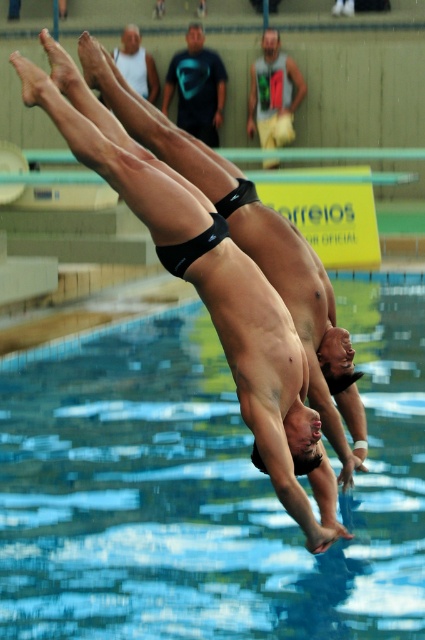
Who is more forward, (235, 314) or (249, 100)?

Point (235, 314) is more forward.

Does black matte swim trunks at center have a greater height compared to green fabric shirt at upper center?

Indeed, black matte swim trunks at center has a greater height compared to green fabric shirt at upper center.

What do you see at coordinates (204, 285) in the screenshot? Image resolution: width=425 pixels, height=640 pixels. I see `black matte swim trunks at center` at bounding box center [204, 285].

Locate an element on the screen. black matte swim trunks at center is located at coordinates (204, 285).

Is the position of transparent glass water at center more distant than that of white matte tank top at upper center?

No, transparent glass water at center is in front of white matte tank top at upper center.

In the scene shown: Who is lower down, transparent glass water at center or white matte tank top at upper center?

Positioned lower is transparent glass water at center.

Who is more forward, (121, 442) or (152, 96)?

Positioned in front is point (121, 442).

You are a GUI agent. You are given a task and a screenshot of the screen. Output one action in this format:
    pyautogui.click(x=<x>, y=<y>)
    Task: Click on the transparent glass water at center
    Image resolution: width=425 pixels, height=640 pixels.
    Given the screenshot: What is the action you would take?
    pyautogui.click(x=201, y=488)

What do you see at coordinates (274, 93) in the screenshot? The width and height of the screenshot is (425, 640). I see `green fabric shirt at upper center` at bounding box center [274, 93].

Is point (266, 56) positioned after point (121, 36)?

That is False.

At what (x,y) coordinates should I click in order to perform the action: click on green fabric shirt at upper center. Please return your answer as a coordinate pair (x, y). The image size is (425, 640). Looking at the image, I should click on (274, 93).